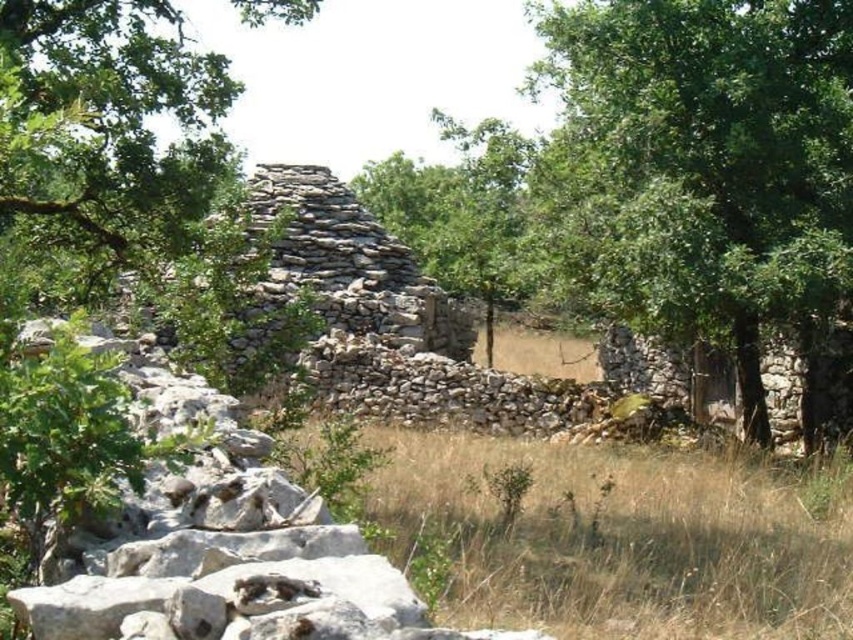
Question: Where is green leafy tree at center located in relation to dry grass at center in the image?

Choices:
 (A) left
 (B) right

Answer: (A)

Question: Is green leafy tree at center closer to the viewer compared to dry grass at center?

Choices:
 (A) yes
 (B) no

Answer: (B)

Question: Which point is farther to the camera?

Choices:
 (A) dry grass at center
 (B) green leafy tree at center

Answer: (B)

Question: Does green leafy tree at center have a smaller size compared to dry grass at center?

Choices:
 (A) yes
 (B) no

Answer: (B)